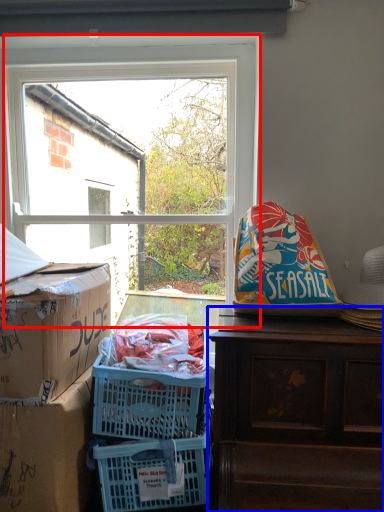
Question: Among these objects, which one is farthest to the camera, window (highlighted by a red box) or desk (highlighted by a blue box)?

Choices:
 (A) window
 (B) desk

Answer: (A)